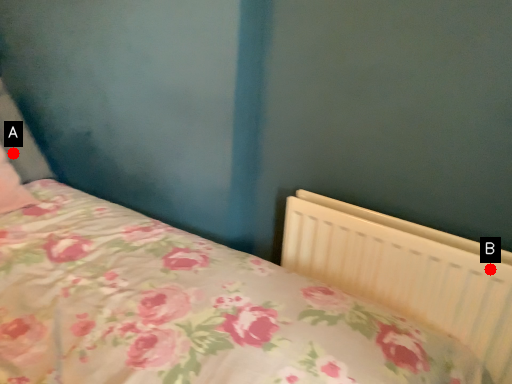
Question: Two points are circled on the image, labeled by A and B beside each circle. Among these points, which one is nearest to the camera?

Choices:
 (A) A is closer
 (B) B is closer

Answer: (B)